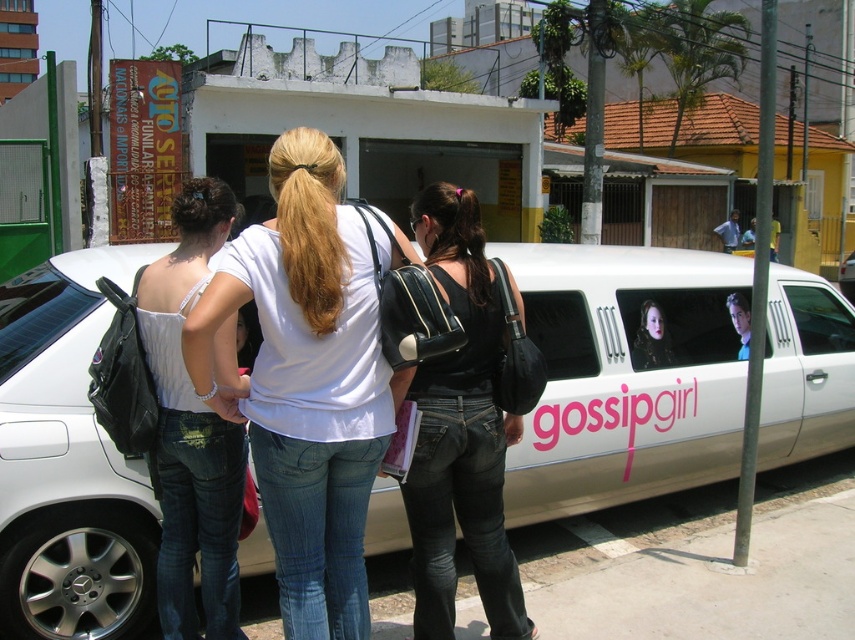
You are taking a photo of the scene and want to focus on both the point at (x=785, y=324) and the point at (x=638, y=356). Which point is closer to the camera?

Point at (x=785, y=324) is closer to the camera than the point at (x=638, y=356) because it is further to the camera according to the description.

You are a photographer trying to capture a clear shot of the smooth black hair at center and the white glossy limousine at center. However, the limousine is blocking your view of the hair. Can you adjust your position to see both subjects without obstruction?

The smooth black hair at center is behind the white glossy limousine at center. To capture both subjects without obstruction, you should move to a position where the limousine is no longer between you and the hair, such as shifting to the side to get an angle where both are visible.